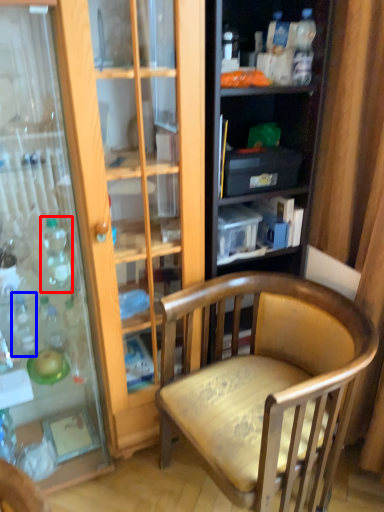
Question: Which of the following is the closest to the observer, bottle (highlighted by a red box) or bottle (highlighted by a blue box)?

Choices:
 (A) bottle
 (B) bottle

Answer: (A)